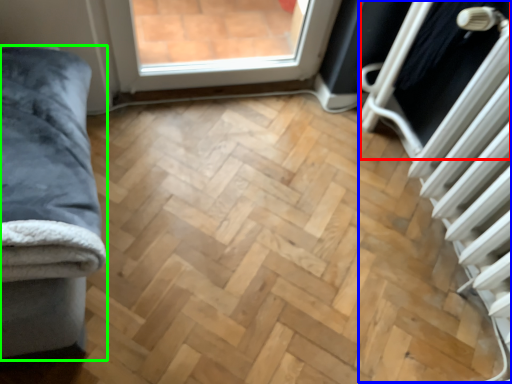
Question: Which is farther away from screen door (highlighted by a red box)? radiator (highlighted by a blue box) or furniture (highlighted by a green box)?

Choices:
 (A) radiator
 (B) furniture

Answer: (B)